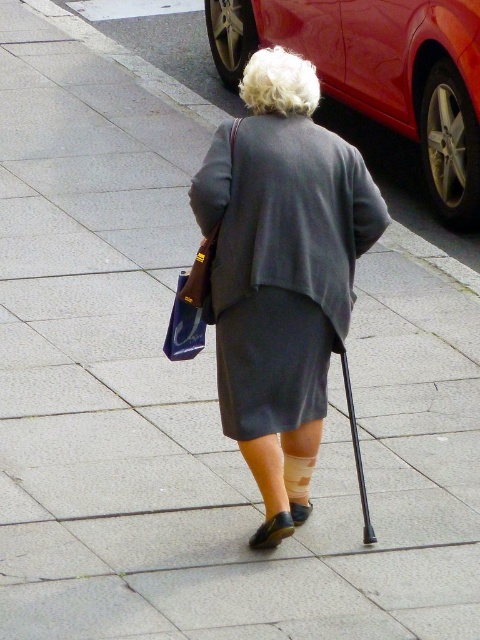
You are a photographer trying to capture the older woman in the scene. You want to ensure both the gray matte coat at center and the blue fabric bag at center are clearly visible in your photo. Based on their positions, which object should you focus on first to ensure both are in frame?

The gray matte coat at center is positioned on the right side of the blue fabric bag at center. To ensure both are in frame, focus on the blue fabric bag at center first, as it is on the left, allowing the gray matte coat at center to naturally come into view on its right side.